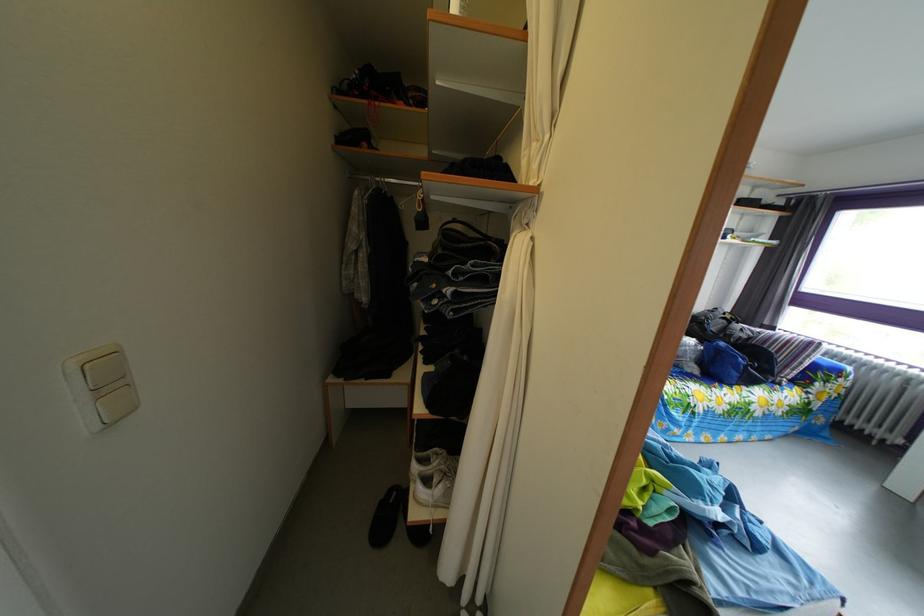
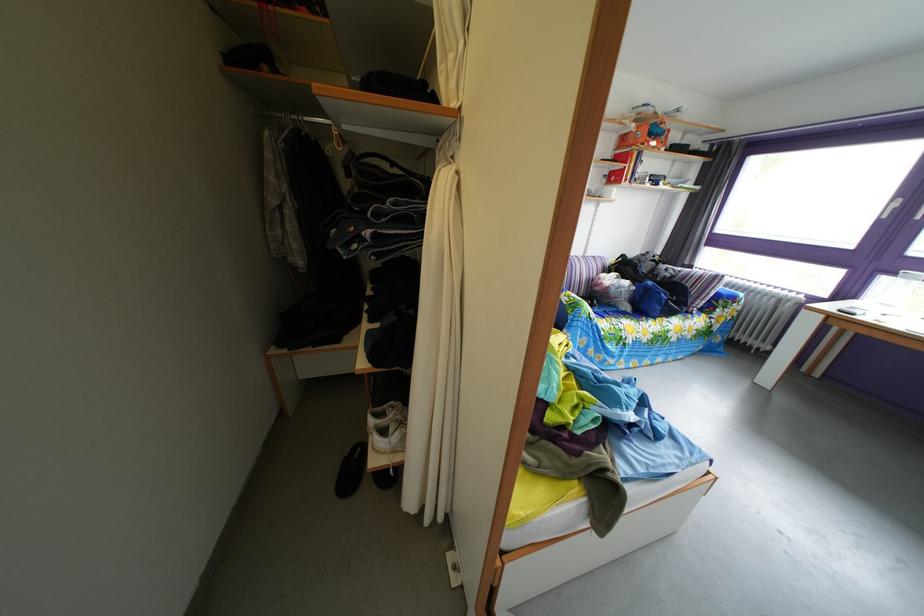
Find the pixel in the second image that matches point (426, 476) in the first image.

(383, 430)